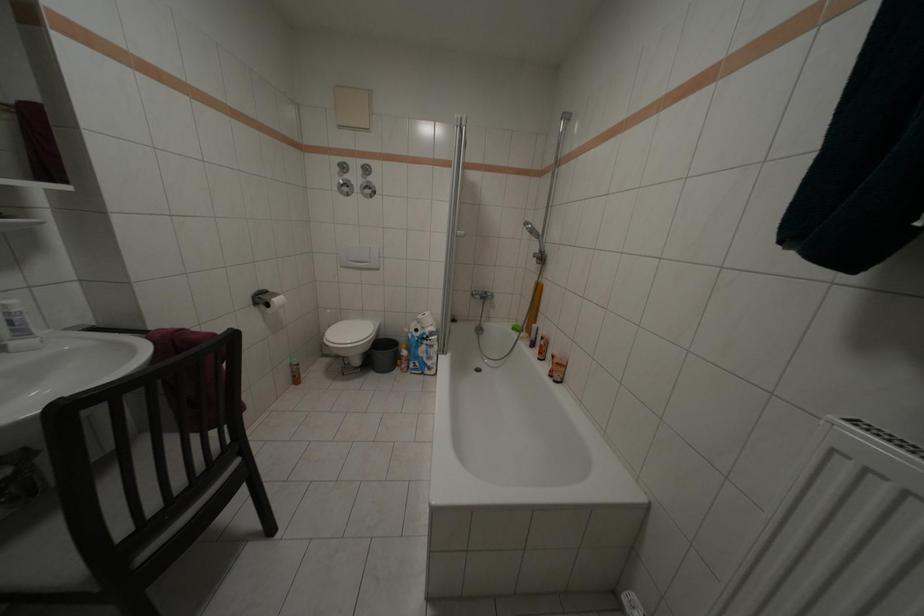
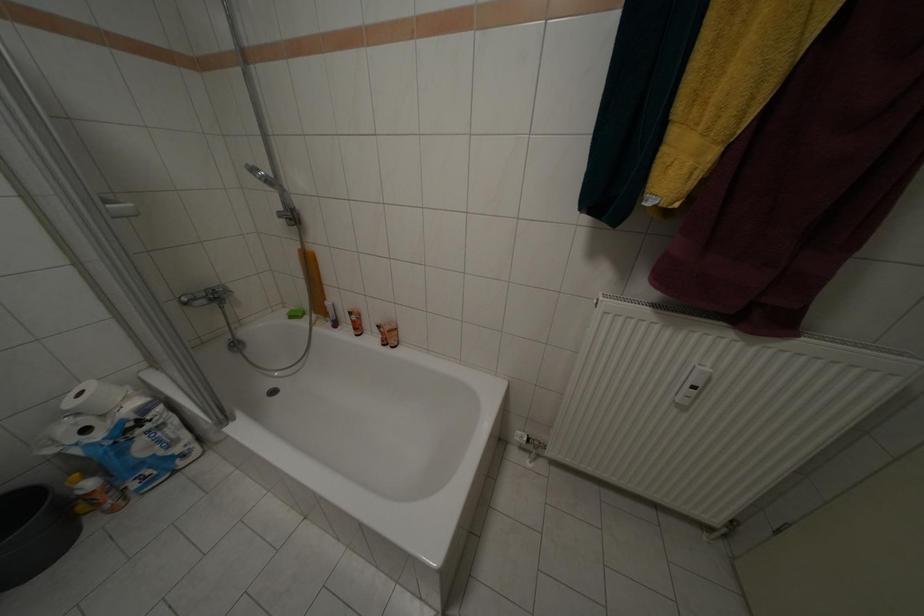
Based on the continuous images, in which direction is the camera rotating?

The camera rotated toward right-down.